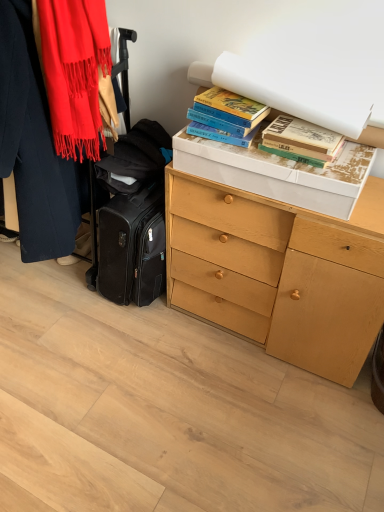
Find the location of `empty space that is ontop of hardcover books at upper right, the second book when ordered from left to right`. empty space that is ontop of hardcover books at upper right, the second book when ordered from left to right is located at coordinates (303, 129).